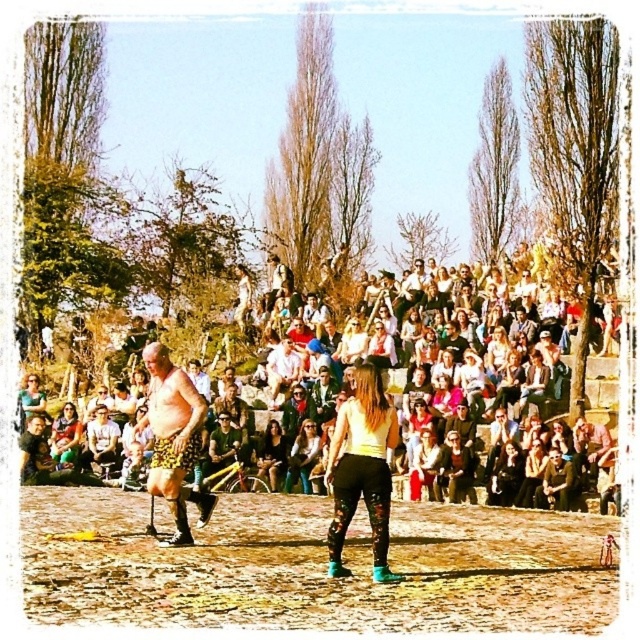
Question: Which object is the closest to the matte black leggings at center?

Choices:
 (A) matte green dress at center
 (B) floral leggings at center

Answer: (B)

Question: Which object is positioned farthest from the matte green dress at center?

Choices:
 (A) leather shorts at left
 (B) denim jacket at center
 (C) matte black leggings at center

Answer: (C)

Question: Can you confirm if matte black leggings at center is positioned to the right of matte green dress at center?

Choices:
 (A) no
 (B) yes

Answer: (B)

Question: Which object is positioned farthest from the floral leggings at center?

Choices:
 (A) matte green dress at center
 (B) denim jacket at center
 (C) dark brown leather jacket at center

Answer: (A)

Question: Is matte black leggings at center bigger than dark brown leather jacket at center?

Choices:
 (A) no
 (B) yes

Answer: (B)

Question: From the image, what is the correct spatial relationship of floral leggings at center in relation to dark brown leather jacket at center?

Choices:
 (A) right
 (B) left

Answer: (A)